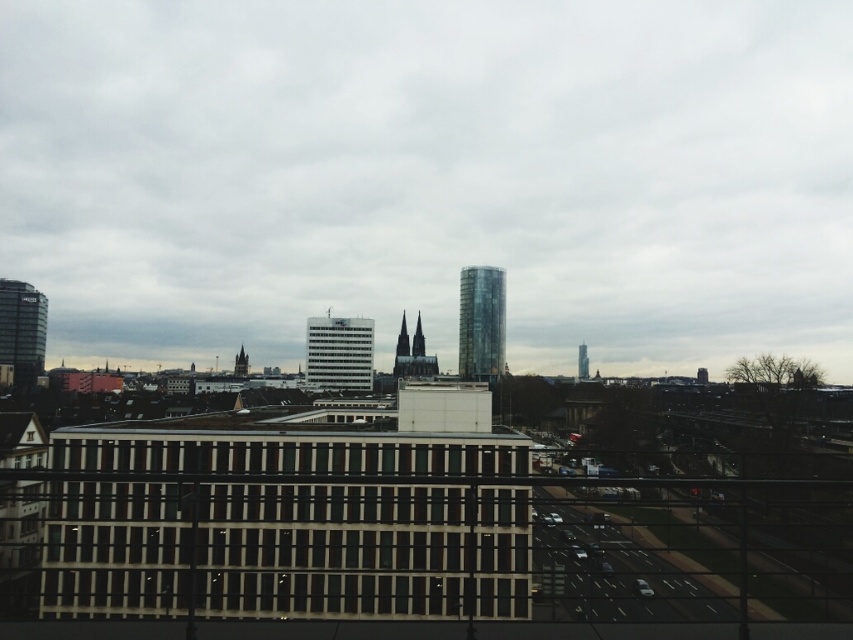
Question: Among these points, which one is farthest from the camera?

Choices:
 (A) (577, 356)
 (B) (468, 368)

Answer: (A)

Question: Estimate the real-world distances between objects in this image. Which object is closer to the white glass building at center?

Choices:
 (A) transparent glass tower at center
 (B) glassy modern skyscraper at center
 (C) dark brown stone tower at center

Answer: (C)

Question: Can you confirm if transparent glass tower at center is positioned to the right of white glass building at center?

Choices:
 (A) yes
 (B) no

Answer: (A)

Question: Does white glass building at center have a larger size compared to dark gray stone cathedral at center?

Choices:
 (A) yes
 (B) no

Answer: (A)

Question: Which object is the farthest from the transparent glass tower at center?

Choices:
 (A) dark brown stone tower at center
 (B) matte glass skyscraper at left
 (C) glassy modern skyscraper at center

Answer: (B)

Question: Does transparent glass tower at center have a lesser width compared to dark brown stone tower at center?

Choices:
 (A) yes
 (B) no

Answer: (B)